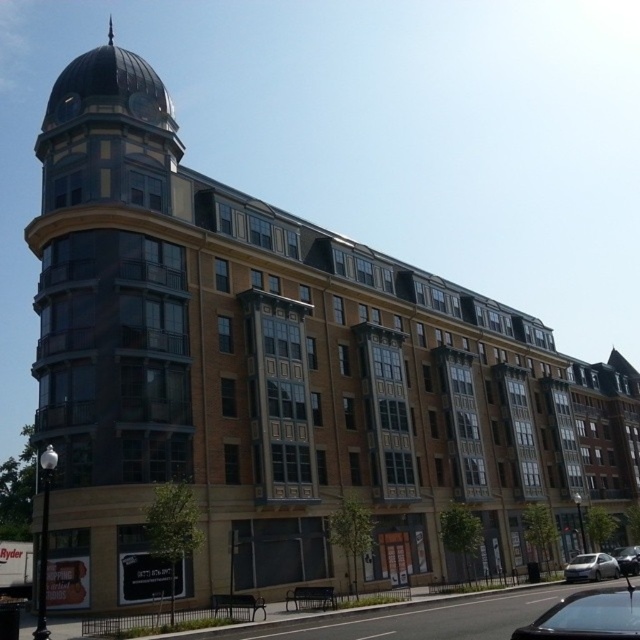
You are a pedestrian standing at the entrance of the building and want to take a photo of the shiny black car at lower right and the satin silver sedan at lower right. Which car should you focus on first to ensure both are in the frame?

You should focus on the shiny black car at lower right first because it is closer to the viewer, so adjusting the camera to capture it ensures the satin silver sedan at lower right, which is further away, will also be in the frame.

You are a pedestrian standing at the entrance of the multi story building and you see the shiny black car at lower right and the shiny silver sedan at lower right. Which car is closer to you?

The shiny black car at lower right is closer to you since it is in front of the shiny silver sedan at lower right.